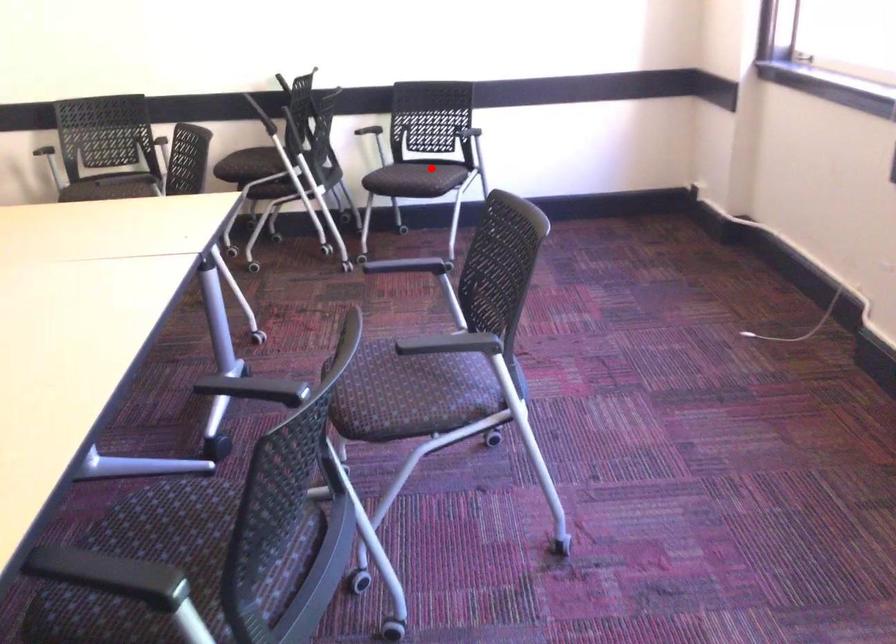
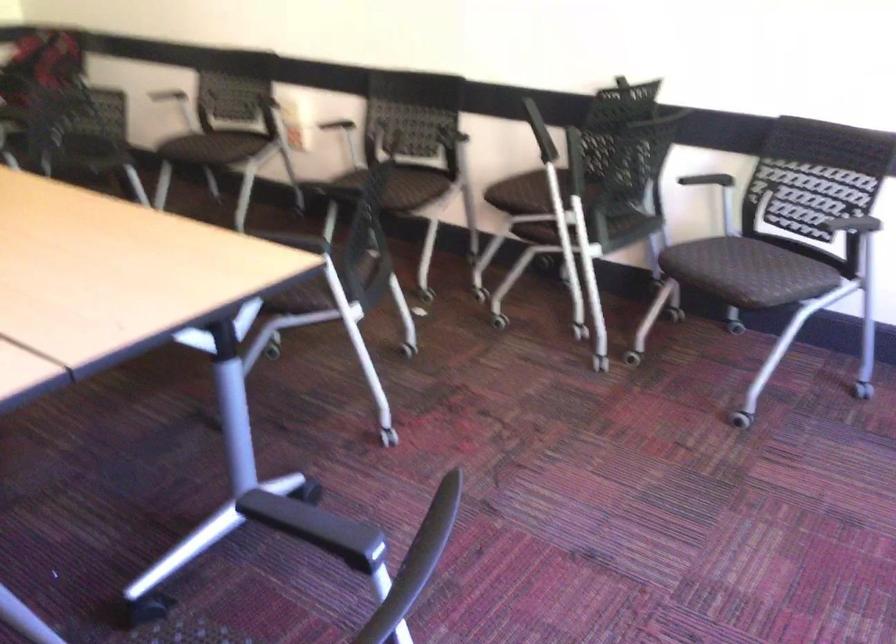
Question: I am providing you with two images of the same scene from different viewpoints. Given a red point in image1, look at the same physical point in image2. Is it:

Choices:
 (A) Closer to the viewpoint
 (B) Farther from the viewpoint

Answer: (A)